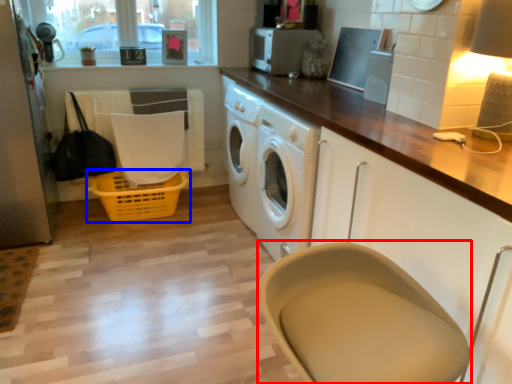
Question: Which point is closer to the camera, feeding chair (highlighted by a red box) or basket (highlighted by a blue box)?

Choices:
 (A) feeding chair
 (B) basket

Answer: (A)